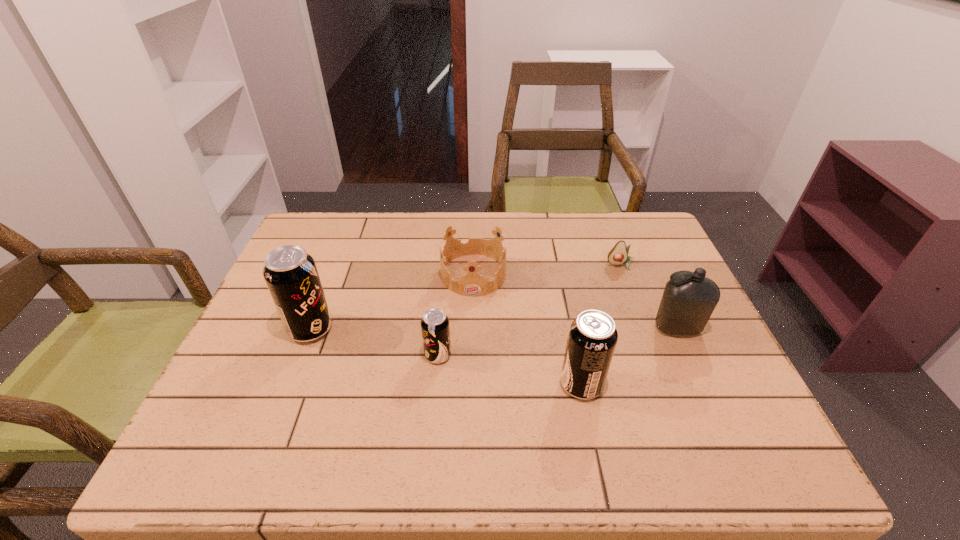
The image size is (960, 540). Find the location of `the leftmost object`. the leftmost object is located at coordinates (291, 275).

Identify the location of the shortest soda can. This screenshot has height=540, width=960. (435, 328).

Locate an element on the screen. The width and height of the screenshot is (960, 540). the third object from right to left is located at coordinates (592, 338).

Identify the location of the nearest soda can. (592, 338).

Identify the location of the shortest object. This screenshot has height=540, width=960. (618, 254).

Find the location of a particular element. tiara is located at coordinates (472, 284).

The image size is (960, 540). In order to click on bottle in this screenshot , I will do `click(687, 303)`.

Where is `vacant region located 0.320m on the back of the leftmost soda can`? This screenshot has width=960, height=540. vacant region located 0.320m on the back of the leftmost soda can is located at coordinates (346, 239).

Locate an element on the screen. The height and width of the screenshot is (540, 960). vacant space situated 0.170m on the back of the second soda can from left to right is located at coordinates coord(444,295).

The height and width of the screenshot is (540, 960). What are the coordinates of `free spot located on the right of the nearest soda can` in the screenshot? It's located at (731, 384).